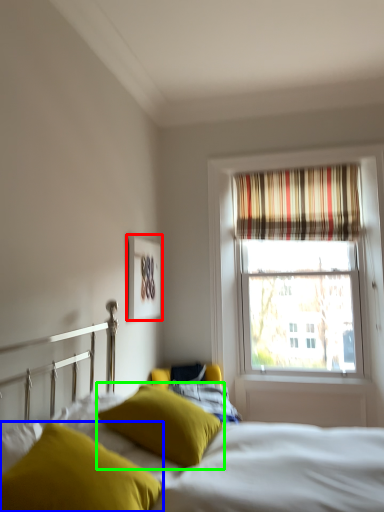
Question: Estimate the real-world distances between objects in this image. Which object is closer to picture frame (highlighted by a red box), pillow (highlighted by a blue box) or pillow (highlighted by a green box)?

Choices:
 (A) pillow
 (B) pillow

Answer: (B)